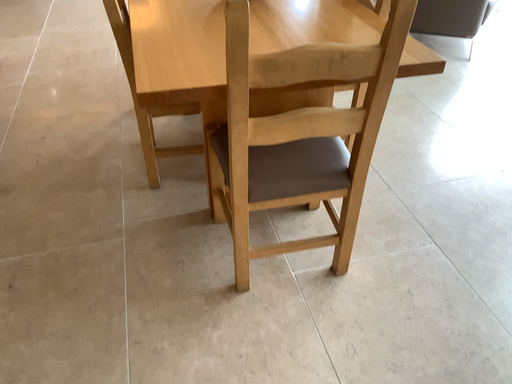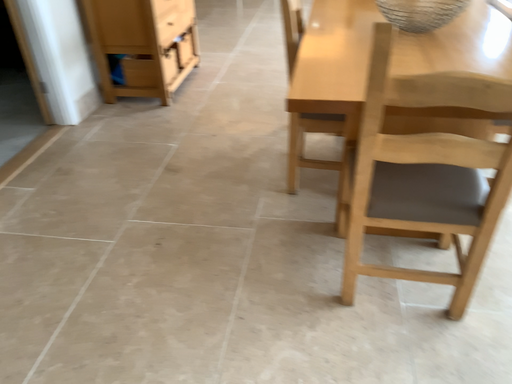
Question: Which way did the camera rotate in the video?

Choices:
 (A) rotated upward
 (B) rotated downward

Answer: (A)